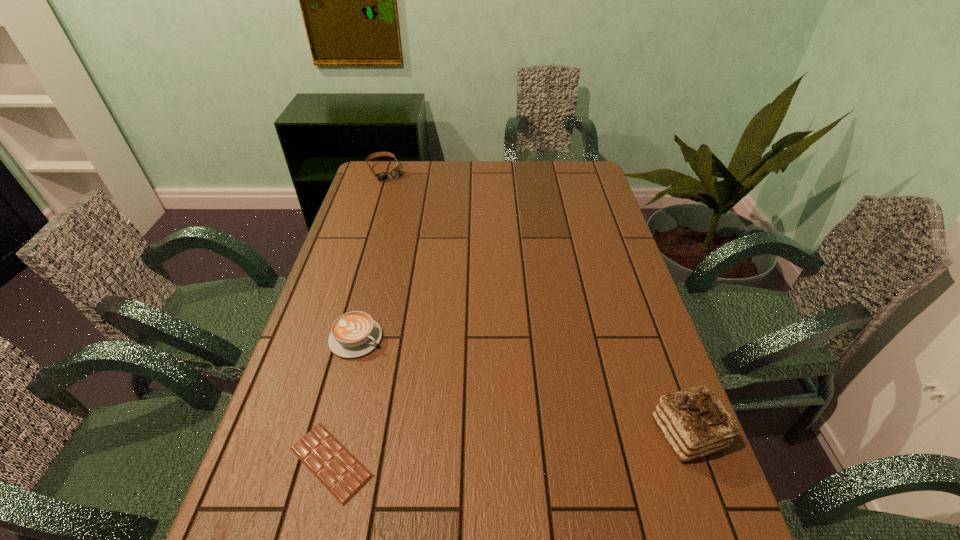
The image size is (960, 540). Find the location of `vacant region between the second farthest object and the farthest object`. vacant region between the second farthest object and the farthest object is located at coordinates tap(371, 255).

Where is `free space that is in between the farthest object and the third nearest object`? free space that is in between the farthest object and the third nearest object is located at coordinates coord(371,255).

You are a GUI agent. You are given a task and a screenshot of the screen. Output one action in this format:
    pyautogui.click(x=<x>, y=<y>)
    Task: Click on the vacant point located between the second farthest object and the goggles
    
    Given the screenshot: What is the action you would take?
    pyautogui.click(x=371, y=255)

Locate an element on the screen. free spot between the tallest object and the chocolate bar is located at coordinates (509, 448).

Locate an element on the screen. vacant point located between the third nearest object and the goggles is located at coordinates (371, 255).

Find the location of a particular element. empty space that is in between the tallest object and the shortest object is located at coordinates (509, 448).

The height and width of the screenshot is (540, 960). Find the location of `empty location between the cappuccino and the goggles`. empty location between the cappuccino and the goggles is located at coordinates (371, 255).

This screenshot has height=540, width=960. What are the coordinates of `the third closest object relative to the shortest object` in the screenshot? It's located at (396, 172).

Identify which object is the closest to the second farthest object. Please provide its 2D coordinates. Your answer should be formatted as a tuple, i.e. [(x, y)], where the tuple contains the x and y coordinates of a point satisfying the conditions above.

[(343, 475)]

This screenshot has height=540, width=960. In order to click on free space that satisfies the following two spatial constraints: 1. on the back side of the chocolate bar; 2. on the left side of the tallest object in this screenshot , I will do `click(338, 433)`.